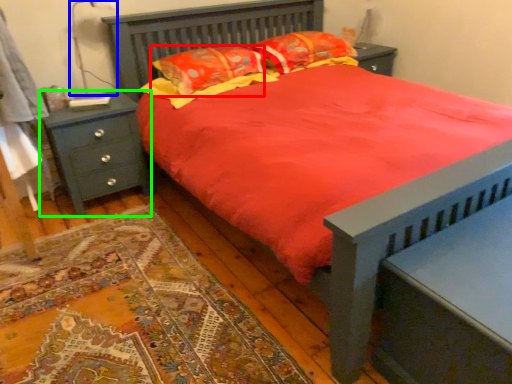
Question: Which object is the farthest from pillow (highlighted by a red box)? Choose among these: table lamp (highlighted by a blue box) or nightstand (highlighted by a green box).

Choices:
 (A) table lamp
 (B) nightstand

Answer: (A)